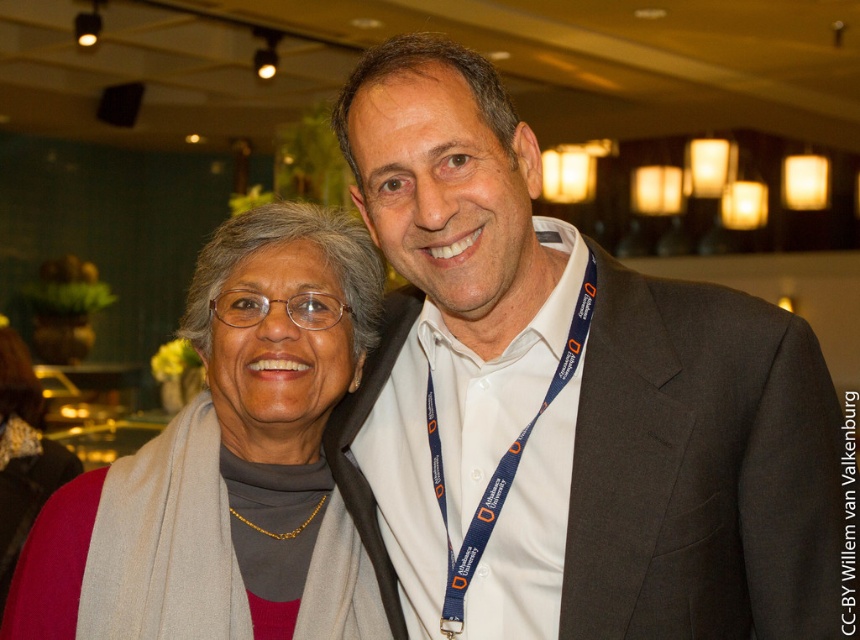
Question: Estimate the real-world distances between objects in this image. Which object is farther from the matte gray scarf at left?

Choices:
 (A) blue fabric lanyard at center
 (B) white shirt at center

Answer: (A)

Question: Is white shirt at center bigger than blue fabric lanyard at center?

Choices:
 (A) yes
 (B) no

Answer: (A)

Question: Considering the relative positions of white shirt at center and blue fabric lanyard at center in the image provided, where is white shirt at center located with respect to blue fabric lanyard at center?

Choices:
 (A) right
 (B) left

Answer: (A)

Question: Which object is the farthest from the blue fabric lanyard at center?

Choices:
 (A) matte gray scarf at left
 (B) white shirt at center

Answer: (A)

Question: Based on their relative distances, which object is farther from the blue fabric lanyard at center?

Choices:
 (A) white shirt at center
 (B) matte gray scarf at left

Answer: (B)

Question: In this image, where is white shirt at center located relative to blue fabric lanyard at center?

Choices:
 (A) below
 (B) above

Answer: (B)